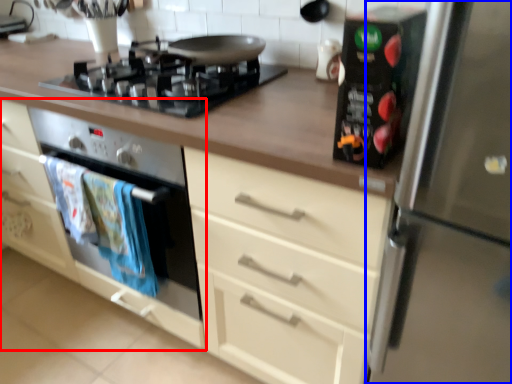
Question: Which object appears closest to the camera in this image, cabinetry (highlighted by a red box) or refrigerator (highlighted by a blue box)?

Choices:
 (A) cabinetry
 (B) refrigerator

Answer: (B)